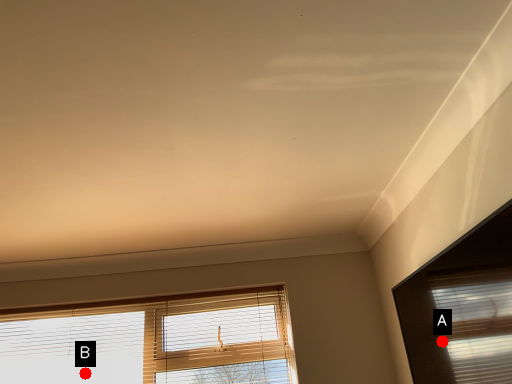
Question: Two points are circled on the image, labeled by A and B beside each circle. Which point is farther from the camera taking this photo?

Choices:
 (A) A is further
 (B) B is further

Answer: (B)